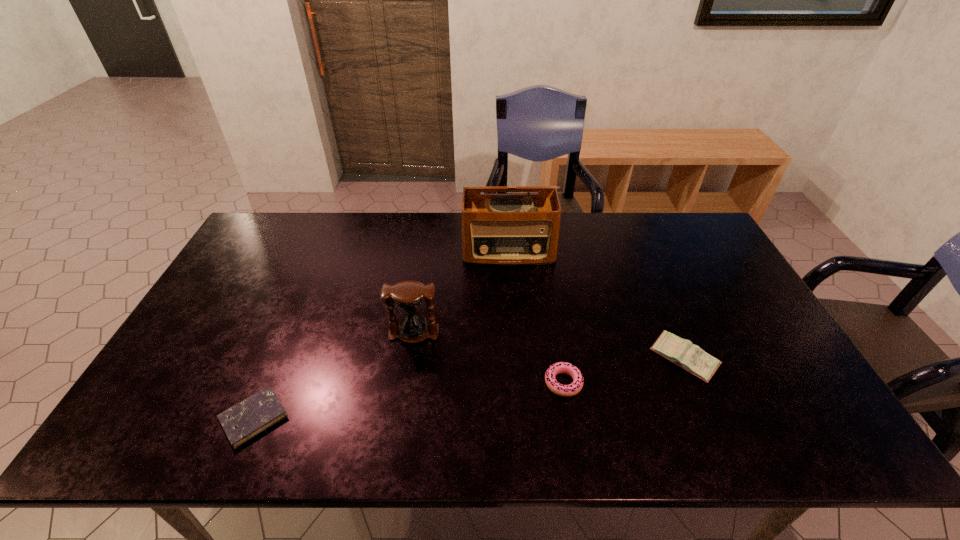
In order to click on free space between the left diary and the hourglass in this screenshot , I will do `click(334, 375)`.

Where is `object that is the second closest to the tallest object`? The image size is (960, 540). object that is the second closest to the tallest object is located at coordinates (682, 352).

At what (x,y) coordinates should I click in order to perform the action: click on object that stands as the third closest to the hourglass. Please return your answer as a coordinate pair (x, y). Image resolution: width=960 pixels, height=540 pixels. Looking at the image, I should click on (575, 387).